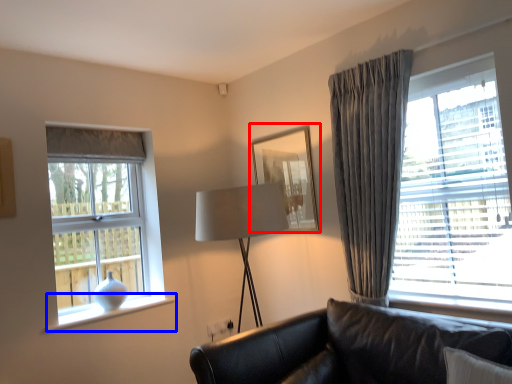
Question: Which object is further to the camera taking this photo, picture frame (highlighted by a red box) or window sill (highlighted by a blue box)?

Choices:
 (A) picture frame
 (B) window sill

Answer: (A)